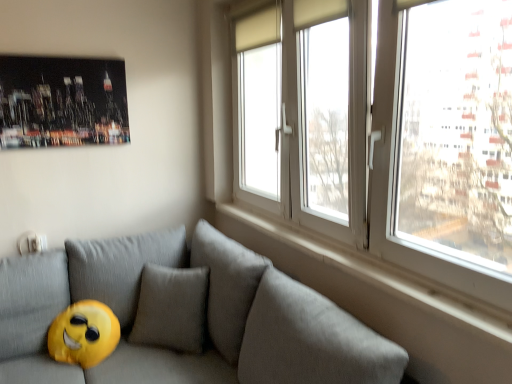
At what (x,y) coordinates should I click in order to perform the action: click on white plastic window at upper right. Please return your answer as a coordinate pair (x, y). The height and width of the screenshot is (384, 512). Looking at the image, I should click on (403, 133).

What do you see at coordinates (185, 317) in the screenshot? This screenshot has width=512, height=384. I see `gray fabric couch at lower left` at bounding box center [185, 317].

Locate an element on the screen. white plastic window at upper right is located at coordinates (403, 133).

From a real-world perspective, which is physically below, gray fabric couch at lower left or shiny metallic poster at upper left?

gray fabric couch at lower left is physically lower.

From the image's perspective, is gray fabric couch at lower left located above or below shiny metallic poster at upper left?

gray fabric couch at lower left is below shiny metallic poster at upper left.

Considering the sizes of gray fabric couch at lower left and shiny metallic poster at upper left in the image, is gray fabric couch at lower left wider or thinner than shiny metallic poster at upper left?

In the image, gray fabric couch at lower left appears to be wider than shiny metallic poster at upper left.

Does point (199, 316) lie behind point (112, 121)?

No.

Who is bigger, white plastic window at upper right or shiny metallic poster at upper left?

With larger size is white plastic window at upper right.

Is shiny metallic poster at upper left at the back of white plastic window at upper right?

white plastic window at upper right does not have its back to shiny metallic poster at upper left.

How different are the orientations of white plastic window at upper right and shiny metallic poster at upper left in degrees?

There is a 90-degree angle between the facing directions of white plastic window at upper right and shiny metallic poster at upper left.

In terms of height, does white plastic window at upper right look taller or shorter compared to shiny metallic poster at upper left?

Considering their sizes, white plastic window at upper right has more height than shiny metallic poster at upper left.

Between white plastic window at upper right and gray fabric couch at lower left, which one is positioned behind?

white plastic window at upper right.

In the scene shown: Which is further, (438, 243) or (254, 380)?

The point (254, 380) is farther.

From the picture: From the image's perspective, does white plastic window at upper right appear higher than gray fabric couch at lower left?

Correct, white plastic window at upper right appears higher than gray fabric couch at lower left in the image.

How many degrees apart are the facing directions of white plastic window at upper right and gray fabric couch at lower left?

1.51 degrees.

Is shiny metallic poster at upper left surrounded by white smooth window sill at upper right?

No, white smooth window sill at upper right does not contain shiny metallic poster at upper left.

Is white smooth window sill at upper right oriented towards shiny metallic poster at upper left?

No, white smooth window sill at upper right does not turn towards shiny metallic poster at upper left.

From a real-world perspective, is white smooth window sill at upper right positioned under shiny metallic poster at upper left based on gravity?

Yes.

Image resolution: width=512 pixels, height=384 pixels. What are the coordinates of `window sill below the shiny metallic poster at upper left (from a real-world perspective)` in the screenshot? It's located at (361, 276).

Are white smooth window sill at upper right and gray fabric couch at lower left beside each other?

white smooth window sill at upper right and gray fabric couch at lower left are clearly separated.

From the image's perspective, which one is positioned higher, white smooth window sill at upper right or gray fabric couch at lower left?

white smooth window sill at upper right is shown above in the image.

Between white smooth window sill at upper right and gray fabric couch at lower left, which one appears on the left side from the viewer's perspective?

From the viewer's perspective, gray fabric couch at lower left appears more on the left side.

In the scene shown: From a real-world perspective, is white smooth window sill at upper right above or below gray fabric couch at lower left?

From a real-world perspective, white smooth window sill at upper right is physically above gray fabric couch at lower left.

In the scene shown: Which object is further away from the camera, shiny metallic poster at upper left or gray fabric couch at lower left?

shiny metallic poster at upper left.

How many degrees apart are the facing directions of shiny metallic poster at upper left and gray fabric couch at lower left?

The angular difference between shiny metallic poster at upper left and gray fabric couch at lower left is 91.6 degrees.

Is shiny metallic poster at upper left in contact with gray fabric couch at lower left?

No, shiny metallic poster at upper left is not beside gray fabric couch at lower left.

Which of these two, shiny metallic poster at upper left or gray fabric couch at lower left, is wider?

gray fabric couch at lower left.

Where is `window sill that appears above the gray fabric couch at lower left (from the image's perspective)`? Image resolution: width=512 pixels, height=384 pixels. window sill that appears above the gray fabric couch at lower left (from the image's perspective) is located at coordinates (361, 276).

Considering the positions of objects gray fabric couch at lower left and white smooth window sill at upper right in the image provided, who is more to the right, gray fabric couch at lower left or white smooth window sill at upper right?

white smooth window sill at upper right.

Between point (169, 323) and point (495, 316), which one is positioned behind?

The point (169, 323) is farther.

Is gray fabric couch at lower left outside of white smooth window sill at upper right?

gray fabric couch at lower left lies outside white smooth window sill at upper right's area.

The width and height of the screenshot is (512, 384). There is a gray fabric couch at lower left. In order to click on picture frame above it (from a real-world perspective) in this screenshot , I will do `click(62, 101)`.

Find the location of a particular element. picture frame above the white plastic window at upper right (from the image's perspective) is located at coordinates pos(62,101).

Considering their positions, is white smooth window sill at upper right positioned further to white plastic window at upper right than shiny metallic poster at upper left?

shiny metallic poster at upper left is further to white plastic window at upper right.

Estimate the real-world distances between objects in this image. Which object is closer to white plastic window at upper right, shiny metallic poster at upper left or white smooth window sill at upper right?

white smooth window sill at upper right is closer to white plastic window at upper right.

Which object lies nearer to the anchor point white smooth window sill at upper right, gray fabric couch at lower left or shiny metallic poster at upper left?

gray fabric couch at lower left is positioned closer to the anchor white smooth window sill at upper right.

Considering their positions, is shiny metallic poster at upper left positioned closer to white smooth window sill at upper right than gray fabric couch at lower left?

gray fabric couch at lower left lies closer to white smooth window sill at upper right than the other object.

Estimate the real-world distances between objects in this image. Which object is further from gray fabric couch at lower left, shiny metallic poster at upper left or white plastic window at upper right?

shiny metallic poster at upper left is further to gray fabric couch at lower left.

Looking at the image, which one is located closer to shiny metallic poster at upper left, white plastic window at upper right or white smooth window sill at upper right?

white smooth window sill at upper right lies closer to shiny metallic poster at upper left than the other object.

From the image, which object appears to be farther from gray fabric couch at lower left, white smooth window sill at upper right or white plastic window at upper right?

white plastic window at upper right is further to gray fabric couch at lower left.

Looking at the image, which one is located closer to shiny metallic poster at upper left, gray fabric couch at lower left or white smooth window sill at upper right?

gray fabric couch at lower left is positioned closer to the anchor shiny metallic poster at upper left.

I want to click on window sill positioned between gray fabric couch at lower left and shiny metallic poster at upper left from near to far, so click(361, 276).

I want to click on window sill between white plastic window at upper right and gray fabric couch at lower left in the up-down direction, so click(x=361, y=276).

What are the coordinates of `window positioned between gray fabric couch at lower left and shiny metallic poster at upper left from near to far` in the screenshot? It's located at (403, 133).

At what (x,y) coordinates should I click in order to perform the action: click on window sill situated between shiny metallic poster at upper left and white plastic window at upper right from left to right. Please return your answer as a coordinate pair (x, y). The image size is (512, 384). Looking at the image, I should click on (361, 276).